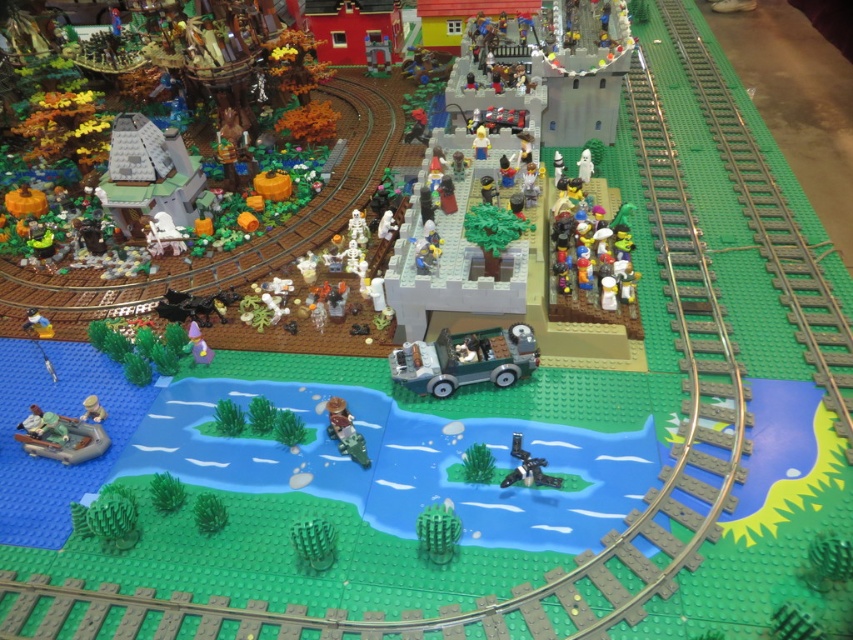
Question: Does smooth gray castle at upper left have a smaller size compared to light tan plastic figure at lower left?

Choices:
 (A) no
 (B) yes

Answer: (A)

Question: Which object is farther from the camera taking this photo?

Choices:
 (A) camouflage plastic boat at center
 (B) light brown wooden boat at lower left

Answer: (B)

Question: Which object is farther from the camera taking this photo?

Choices:
 (A) light yellow plastic minifigure at center
 (B) smooth gray castle at upper left
 (C) light brown wooden boat at lower left
 (D) camouflage plastic boat at center

Answer: (A)

Question: Considering the relative positions of rubber green boat at lower left and light yellow plastic minifigure at center in the image provided, where is rubber green boat at lower left located with respect to light yellow plastic minifigure at center?

Choices:
 (A) above
 (B) below

Answer: (B)

Question: Is the position of smooth gray castle at upper left more distant than that of light yellow plastic minifigure at center?

Choices:
 (A) yes
 (B) no

Answer: (B)

Question: Which point is farther to the camera?

Choices:
 (A) light yellow plastic minifigure at center
 (B) light tan plastic figure at lower left
 (C) smooth gray castle at upper left

Answer: (A)